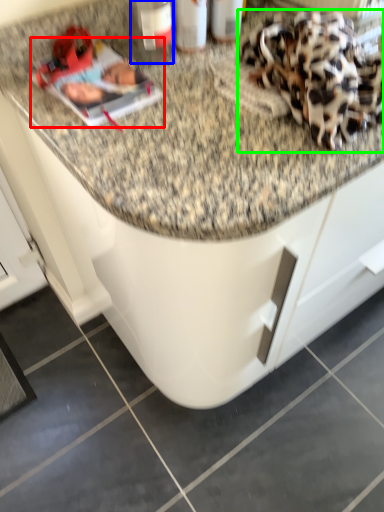
Question: Which object is positioned closest to magazine (highlighted by a red box)? Select from bottle (highlighted by a blue box) and stuff (highlighted by a green box).

Choices:
 (A) bottle
 (B) stuff

Answer: (A)